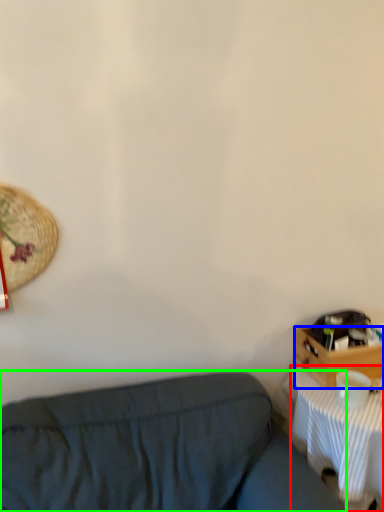
Question: Which is nearer to the desk (highlighted by a red box)? drawer (highlighted by a blue box) or studio couch (highlighted by a green box).

Choices:
 (A) drawer
 (B) studio couch

Answer: (A)